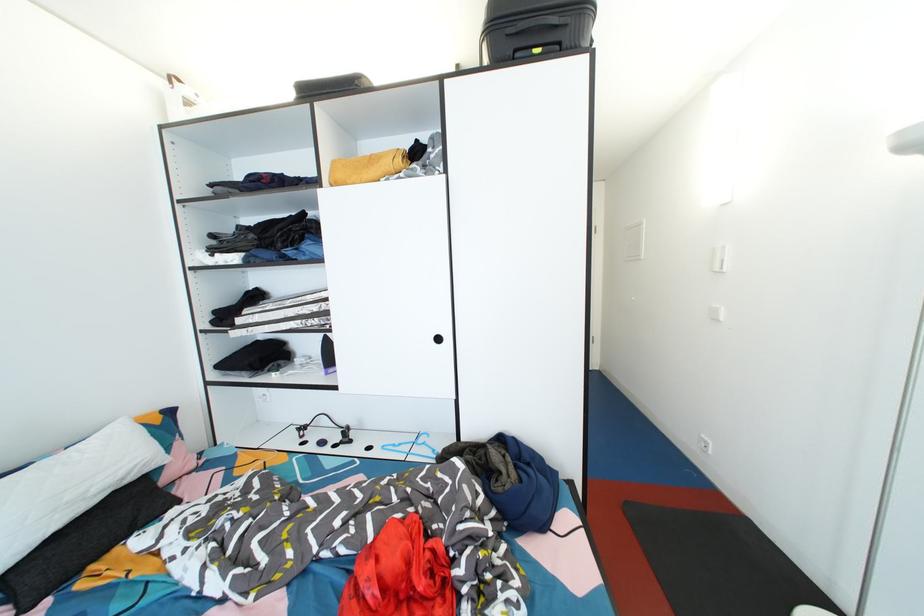
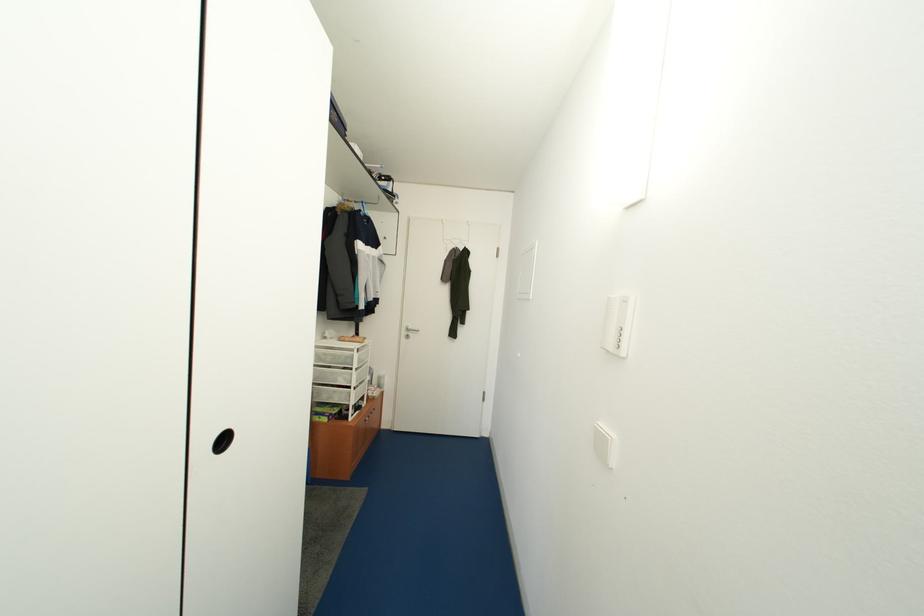
In a continuous first-person perspective shot, in which direction is the camera moving?

The cameraman moved toward right, forward.